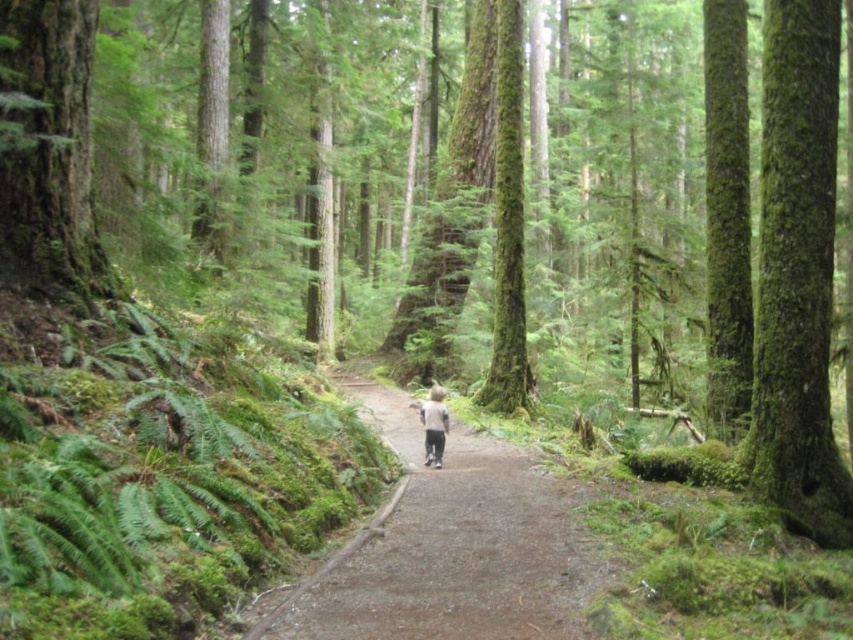
Question: Among these points, which one is farthest from the camera?

Choices:
 (A) (35, 134)
 (B) (820, 8)

Answer: (B)

Question: Estimate the real-world distances between objects in this image. Which object is farther from the green mossy tree at left?

Choices:
 (A) dirt path at center
 (B) light gray fabric at center
 (C) green mossy tree trunk at right

Answer: (C)

Question: Considering the relative positions of green mossy tree trunk at right and green mossy tree at left in the image provided, where is green mossy tree trunk at right located with respect to green mossy tree at left?

Choices:
 (A) below
 (B) above

Answer: (A)

Question: Estimate the real-world distances between objects in this image. Which object is farther from the green mossy tree at left?

Choices:
 (A) green mossy tree trunk at right
 (B) dirt path at center

Answer: (A)

Question: Does green mossy tree trunk at right have a lesser width compared to light gray fabric at center?

Choices:
 (A) no
 (B) yes

Answer: (A)

Question: Is dirt path at center below light gray fabric at center?

Choices:
 (A) yes
 (B) no

Answer: (A)